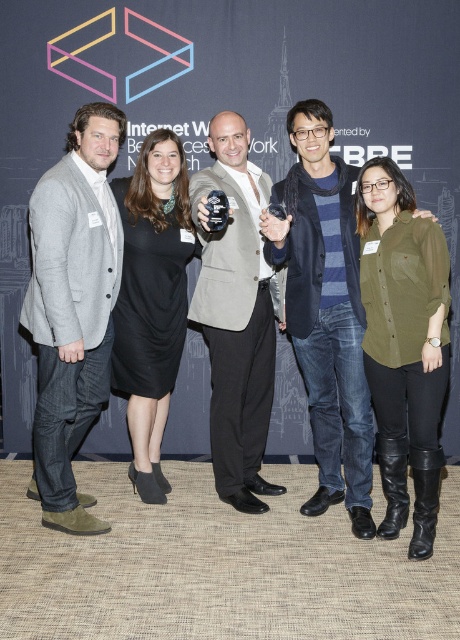
Between matte gray blazer at center and black dress at center, which one is positioned higher?

matte gray blazer at center

Where is `matte gray blazer at center`? matte gray blazer at center is located at coordinates (235, 316).

The width and height of the screenshot is (460, 640). What are the coordinates of `matte gray blazer at center` in the screenshot? It's located at (235, 316).

Who is positioned more to the left, matte gray blazer at left or olive-green cotton shirt at center-right?

matte gray blazer at left

Is point (32, 225) more distant than point (378, 212)?

No.

Find the location of a particular element. This screenshot has height=640, width=460. matte gray blazer at left is located at coordinates (73, 307).

Is dark blue striped sweater at center bigger than matte gray blazer at center?

Actually, dark blue striped sweater at center might be smaller than matte gray blazer at center.

Is point (344, 211) positioned before point (248, 438)?

Yes, it is in front of point (248, 438).

The height and width of the screenshot is (640, 460). What are the coordinates of `dark blue striped sweater at center` in the screenshot? It's located at (326, 308).